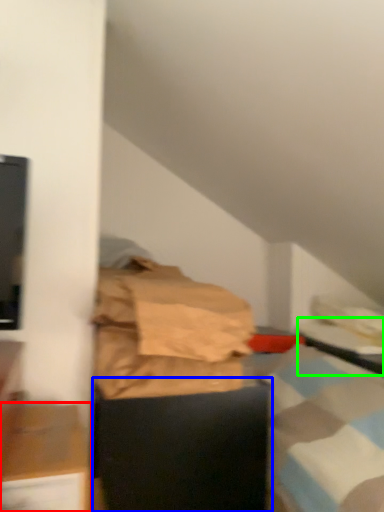
Question: Which object is the closest to the furniture (highlighted by a red box)? Choose among these: furniture (highlighted by a blue box) or table (highlighted by a green box).

Choices:
 (A) furniture
 (B) table

Answer: (A)